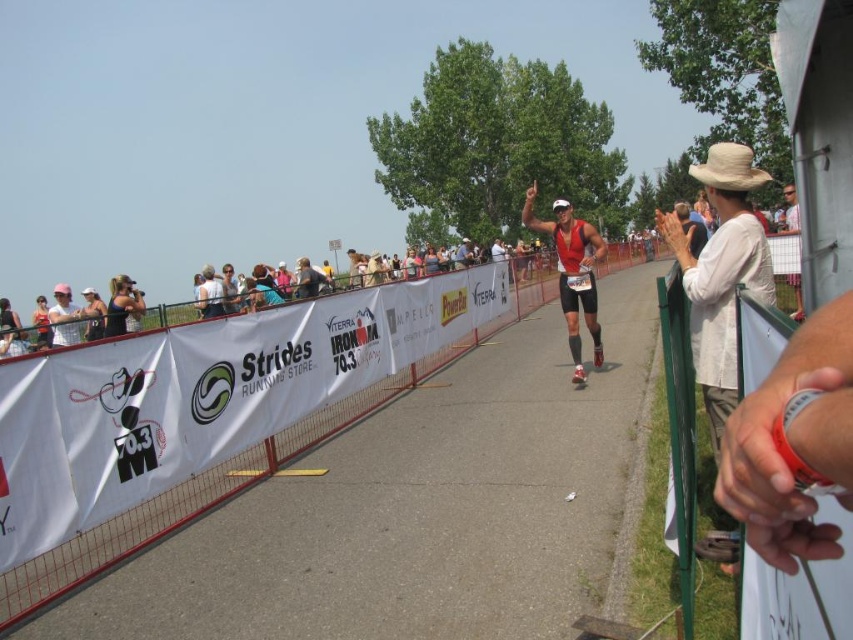
Question: Is matte red triathlon suit at center thinner than white cotton shirt at right?

Choices:
 (A) no
 (B) yes

Answer: (B)

Question: Does matte red triathlon suit at center come behind white cotton shirt at right?

Choices:
 (A) yes
 (B) no

Answer: (A)

Question: Which object appears farthest from the camera in this image?

Choices:
 (A) matte red triathlon suit at center
 (B) white cotton shirt at right

Answer: (A)

Question: Which point appears closest to the camera in this image?

Choices:
 (A) (796, 282)
 (B) (561, 212)

Answer: (B)

Question: Observing the image, what is the correct spatial positioning of matte red triathlon suit at center in reference to white cotton shirt at right?

Choices:
 (A) below
 (B) above

Answer: (A)